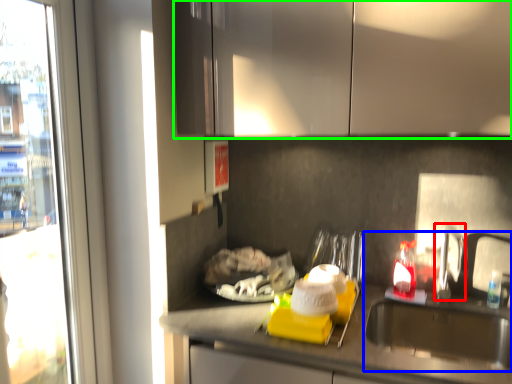
Question: Based on their relative distances, which object is farther from faucet (highlighted by a red box)? Choose from sink (highlighted by a blue box) and cabinetry (highlighted by a green box).

Choices:
 (A) sink
 (B) cabinetry

Answer: (B)